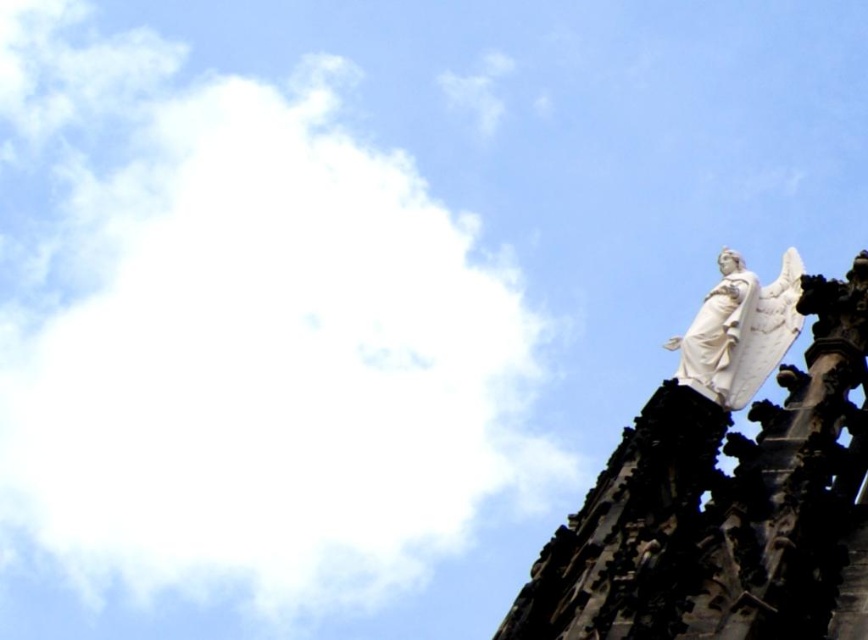
In the scene shown: You are an artist sketching the cathedral scene. You notice the white fluffy cloud at upper left and the white stone angel at upper right. Which one appears wider in your drawing?

The white fluffy cloud at upper left appears wider than the white stone angel at upper right because its width is larger.

You are an artist trying to sketch the scene. You want to draw the white fluffy cloud at upper left first. Where exactly should you place it on your canvas?

You should place the white fluffy cloud at upper left at point (238, 342) on your canvas.